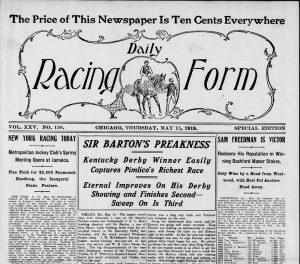
Where is `newspaper`? The width and height of the screenshot is (300, 264). newspaper is located at coordinates (111, 21).